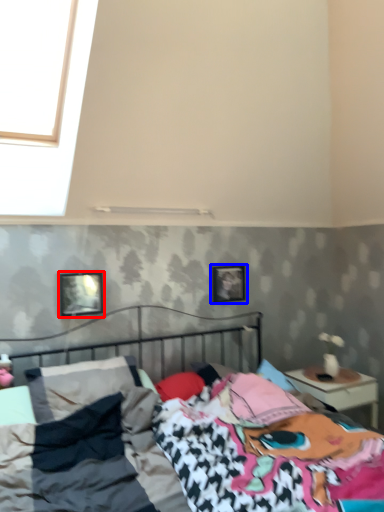
Question: Which point is closer to the camera, picture frame (highlighted by a red box) or picture frame (highlighted by a blue box)?

Choices:
 (A) picture frame
 (B) picture frame

Answer: (A)